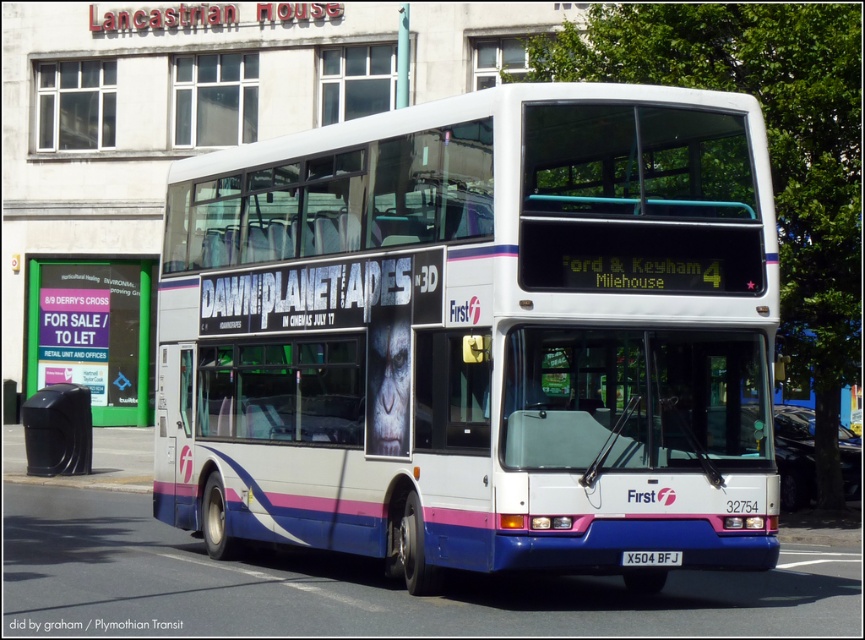
In the scene shown: Between white glossy decker bus at center and white plastic license plate at center, which one appears on the right side from the viewer's perspective?

From the viewer's perspective, white plastic license plate at center appears more on the right side.

Which is below, white glossy decker bus at center or white plastic license plate at center?

white plastic license plate at center is below.

What do you see at coordinates (479, 336) in the screenshot?
I see `white glossy decker bus at center` at bounding box center [479, 336].

Find the location of a particular element. This screenshot has width=865, height=640. white glossy decker bus at center is located at coordinates (479, 336).

What do you see at coordinates (479, 336) in the screenshot? This screenshot has width=865, height=640. I see `white glossy decker bus at center` at bounding box center [479, 336].

Which is behind, point (753, 115) or point (67, 429)?

Positioned behind is point (67, 429).

The width and height of the screenshot is (865, 640). I want to click on white glossy decker bus at center, so click(x=479, y=336).

Find the location of a particular element. This screenshot has height=640, width=865. white glossy decker bus at center is located at coordinates (479, 336).

Which of these two, black plastic trash can at lower left or white plastic license plate at center, stands shorter?

With less height is white plastic license plate at center.

Is black plastic trash can at lower left thinner than white plastic license plate at center?

No.

The image size is (865, 640). What do you see at coordinates (58, 429) in the screenshot?
I see `black plastic trash can at lower left` at bounding box center [58, 429].

Locate an element on the screen. Image resolution: width=865 pixels, height=640 pixels. black plastic trash can at lower left is located at coordinates (58, 429).